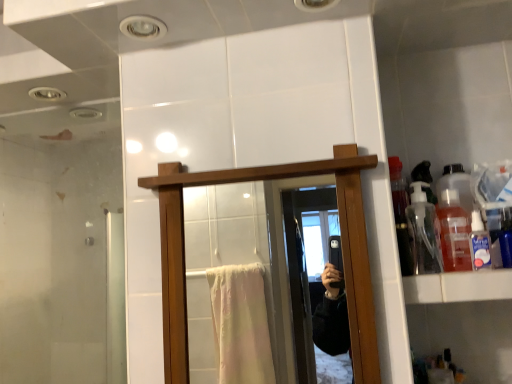
Describe the element at coordinates (458, 286) in the screenshot. This screenshot has width=512, height=384. I see `white glossy cabinet at right` at that location.

Measure the distance between point (487, 267) and camera.

They are 32.72 inches apart.

Locate an element on the screen. This screenshot has width=512, height=384. clear plastic bottle at upper right is located at coordinates pyautogui.click(x=479, y=243).

You are a GUI agent. You are given a task and a screenshot of the screen. Output one action in this format:
    pyautogui.click(x=<x>, y=<y>)
    Task: Click on the white glossy cabinet at right
    Image resolution: width=512 pixels, height=384 pixels.
    Given the screenshot: What is the action you would take?
    pyautogui.click(x=458, y=286)

Considering the relative positions of clear plastic bottle at upper right and wooden mirror at center in the image provided, is clear plastic bottle at upper right to the left or to the right of wooden mirror at center?

From the image, it's evident that clear plastic bottle at upper right is to the right of wooden mirror at center.

Is clear plastic bottle at upper right next to wooden mirror at center and touching it?

clear plastic bottle at upper right and wooden mirror at center are clearly separated.

Does clear plastic bottle at upper right have a greater width compared to wooden mirror at center?

In fact, clear plastic bottle at upper right might be narrower than wooden mirror at center.

Is clear plastic bottle at upper right oriented towards wooden mirror at center?

No.

Considering the sizes of white glossy cabinet at right and transparent plastic bottle at upper right, the 2th bottle viewed from the right, in the image, is white glossy cabinet at right taller or shorter than transparent plastic bottle at upper right, the 2th bottle viewed from the right,?

In the image, white glossy cabinet at right appears to be shorter than transparent plastic bottle at upper right, the 2th bottle viewed from the right.

From the image's perspective, is white glossy cabinet at right positioned above or below transparent plastic bottle at upper right, the 1th bottle viewed from the left?

white glossy cabinet at right is below transparent plastic bottle at upper right, the 1th bottle viewed from the left.

Can you confirm if white glossy cabinet at right is smaller than transparent plastic bottle at upper right, the 1th bottle viewed from the left?

Incorrect, white glossy cabinet at right is not smaller in size than transparent plastic bottle at upper right, the 1th bottle viewed from the left.

From a real-world perspective, is white glossy cabinet at right over transparent plastic bottle at upper right, the 1th bottle viewed from the left?

No.

Locate an element on the screen. The image size is (512, 384). the 1st bottle positioned above the wooden mirror at center (from a real-world perspective) is located at coordinates (454, 232).

How distant is wooden mirror at center from translucent plastic bottle at upper right, the first bottle in the right-to-left sequence?

3.31 feet.

In the scene shown: Is wooden mirror at center inside the boundaries of translucent plastic bottle at upper right, the first bottle in the right-to-left sequence, or outside?

wooden mirror at center is located beyond the bounds of translucent plastic bottle at upper right, the first bottle in the right-to-left sequence.

Which is more to the left, translucent plastic bottle at upper right, arranged as the 2th bottle when viewed from the left, or white glossy cabinet at right?

translucent plastic bottle at upper right, arranged as the 2th bottle when viewed from the left, is more to the left.

From the image's perspective, is translucent plastic bottle at upper right, the first bottle in the right-to-left sequence, beneath white glossy cabinet at right?

No.

From a real-world perspective, is translucent plastic bottle at upper right, arranged as the 2th bottle when viewed from the left, located higher than white glossy cabinet at right?

Yes, from a real-world perspective, translucent plastic bottle at upper right, arranged as the 2th bottle when viewed from the left, is on top of white glossy cabinet at right.

Looking at this image, how distant is translucent plastic bottle at upper right, arranged as the 2th bottle when viewed from the left, from white glossy cabinet at right?

The distance of translucent plastic bottle at upper right, arranged as the 2th bottle when viewed from the left, from white glossy cabinet at right is 2.78 inches.

Looking at this image, from a real-world perspective, which object stands above the other?

From a 3D spatial view, translucent plastic bottle at upper right, arranged as the 2th bottle when viewed from the left, is above.

Is white glossy cabinet at right far away from translucent plastic bottle at upper right, the first bottle in the right-to-left sequence?

No, white glossy cabinet at right is not far away from translucent plastic bottle at upper right, the first bottle in the right-to-left sequence.

Is white glossy cabinet at right inside the boundaries of translucent plastic bottle at upper right, arranged as the 2th bottle when viewed from the left, or outside?

white glossy cabinet at right is not inside translucent plastic bottle at upper right, arranged as the 2th bottle when viewed from the left, it's outside.

Considering the sizes of objects white glossy cabinet at right and translucent plastic bottle at upper right, arranged as the 2th bottle when viewed from the left, in the image provided, who is thinner, white glossy cabinet at right or translucent plastic bottle at upper right, arranged as the 2th bottle when viewed from the left,?

Thinner between the two is translucent plastic bottle at upper right, arranged as the 2th bottle when viewed from the left.

Is translucent plastic bottle at upper right, arranged as the 2th bottle when viewed from the left, surrounding wooden mirror at center?

No, wooden mirror at center is not surrounded by translucent plastic bottle at upper right, arranged as the 2th bottle when viewed from the left.

Is translucent plastic bottle at upper right, the first bottle in the right-to-left sequence, next to wooden mirror at center?

No, translucent plastic bottle at upper right, the first bottle in the right-to-left sequence, is not with wooden mirror at center.

Is translucent plastic bottle at upper right, arranged as the 2th bottle when viewed from the left, wider than wooden mirror at center?

No, translucent plastic bottle at upper right, arranged as the 2th bottle when viewed from the left, is not wider than wooden mirror at center.

This screenshot has height=384, width=512. I want to click on mirror to the left of translucent plastic bottle at upper right, arranged as the 2th bottle when viewed from the left, so click(x=246, y=285).

Does transparent plastic bottle at upper right, the 1th bottle viewed from the left, contain wooden mirror at center?

Definitely not — wooden mirror at center is not inside transparent plastic bottle at upper right, the 1th bottle viewed from the left.

From the picture: Is transparent plastic bottle at upper right, the 1th bottle viewed from the left, positioned far away from wooden mirror at center?

Actually, transparent plastic bottle at upper right, the 1th bottle viewed from the left, and wooden mirror at center are a little close together.

In order to click on toiletry behind the wooden mirror at center in this screenshot , I will do `click(479, 243)`.

Identify the location of cabinet below the transparent plastic bottle at upper right, the 2th bottle viewed from the right (from a real-world perspective). The width and height of the screenshot is (512, 384). click(458, 286).

Looking at this image, looking at the image, which one is located closer to clear plastic bottle at upper right, wooden mirror at center or transparent plastic bottle at upper right, the 1th bottle viewed from the left?

transparent plastic bottle at upper right, the 1th bottle viewed from the left, is closer to clear plastic bottle at upper right.

Looking at this image, which object lies nearer to the anchor point clear plastic bottle at upper right, translucent plastic bottle at upper right, the first bottle in the right-to-left sequence, or white glossy cabinet at right?

translucent plastic bottle at upper right, the first bottle in the right-to-left sequence, is positioned closer to the anchor clear plastic bottle at upper right.

Considering their positions, is wooden mirror at center positioned closer to translucent plastic bottle at upper right, arranged as the 2th bottle when viewed from the left, than white glossy cabinet at right?

Based on the image, white glossy cabinet at right appears to be nearer to translucent plastic bottle at upper right, arranged as the 2th bottle when viewed from the left.

Looking at the image, which one is located closer to transparent plastic bottle at upper right, the 2th bottle viewed from the right, clear plastic bottle at upper right or white glossy cabinet at right?

clear plastic bottle at upper right is closer to transparent plastic bottle at upper right, the 2th bottle viewed from the right.

When comparing their distances from white glossy cabinet at right, does clear plastic bottle at upper right or wooden mirror at center seem closer?

clear plastic bottle at upper right.

Based on their spatial positions, is wooden mirror at center or white glossy cabinet at right further from transparent plastic bottle at upper right, the 1th bottle viewed from the left?

wooden mirror at center is further to transparent plastic bottle at upper right, the 1th bottle viewed from the left.

Based on their spatial positions, is translucent plastic bottle at upper right, the first bottle in the right-to-left sequence, or wooden mirror at center further from transparent plastic bottle at upper right, the 2th bottle viewed from the right?

wooden mirror at center is positioned further to the anchor transparent plastic bottle at upper right, the 2th bottle viewed from the right.

Which object lies further to the anchor point white glossy cabinet at right, wooden mirror at center or transparent plastic bottle at upper right, the 1th bottle viewed from the left?

wooden mirror at center.

At what (x,y) coordinates should I click in order to perform the action: click on bottle located between transparent plastic bottle at upper right, the 1th bottle viewed from the left, and clear plastic bottle at upper right in the left-right direction. Please return your answer as a coordinate pair (x, y). This screenshot has width=512, height=384. Looking at the image, I should click on (454, 232).

Find the location of `toiletry that lies between translucent plastic bottle at upper right, arranged as the 2th bottle when viewed from the left, and white glossy cabinet at right from top to bottom`. toiletry that lies between translucent plastic bottle at upper right, arranged as the 2th bottle when viewed from the left, and white glossy cabinet at right from top to bottom is located at coordinates (479, 243).

In order to click on bottle between wooden mirror at center and translucent plastic bottle at upper right, arranged as the 2th bottle when viewed from the left, in the horizontal direction in this screenshot , I will do `click(424, 232)`.

The height and width of the screenshot is (384, 512). I want to click on cabinet between wooden mirror at center and clear plastic bottle at upper right in the horizontal direction, so click(458, 286).